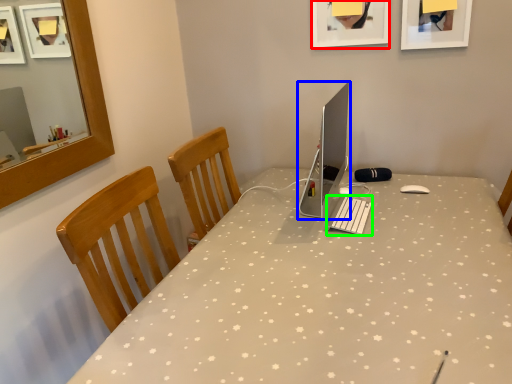
Question: Based on their relative distances, which object is farther from picture frame (highlighted by a red box)? Choose from computer monitor (highlighted by a blue box) and laptop keyboard (highlighted by a green box).

Choices:
 (A) computer monitor
 (B) laptop keyboard

Answer: (B)